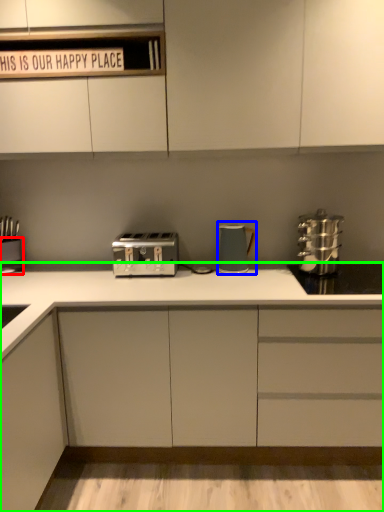
Question: Considering the real-world distances, which object is farthest from appliance (highlighted by a red box)? kitchen appliance (highlighted by a blue box) or cabinetry (highlighted by a green box)?

Choices:
 (A) kitchen appliance
 (B) cabinetry

Answer: (A)